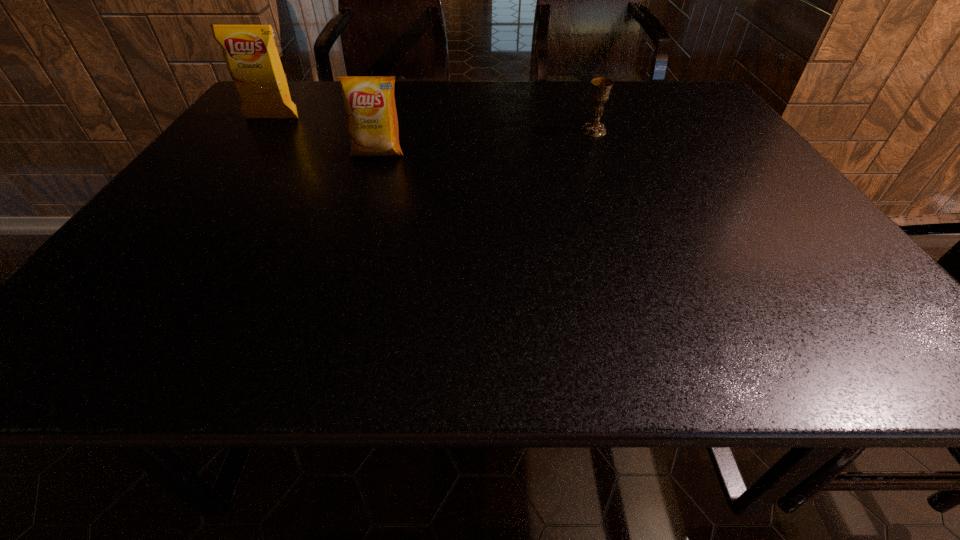
In order to click on free spot between the rightmost object and the farthest object in this screenshot , I will do `click(433, 125)`.

At what (x,y) coordinates should I click in order to perform the action: click on vacant region between the second shortest object and the second nearest object. Please return your answer as a coordinate pair (x, y). Looking at the image, I should click on click(486, 142).

You are a GUI agent. You are given a task and a screenshot of the screen. Output one action in this format:
    pyautogui.click(x=<x>, y=<y>)
    Task: Click on the empty space between the rightmost object and the tallest object
    
    Given the screenshot: What is the action you would take?
    pyautogui.click(x=433, y=125)

Find the location of a particular element. This screenshot has height=540, width=960. free space between the shorter crisp (potato chip) and the leftmost object is located at coordinates (324, 136).

What are the coordinates of `vacant region between the nearest object and the farthest object` in the screenshot? It's located at (324, 136).

Locate an element on the screen. The image size is (960, 540). empty space between the tallest object and the shortest object is located at coordinates (433, 125).

I want to click on free point between the right crisp (potato chip) and the taller crisp (potato chip), so click(x=324, y=136).

Identify the location of the second closest object relative to the nearer crisp (potato chip). The image size is (960, 540). (601, 87).

Find the location of `object that stands as the closest to the farthest object`. object that stands as the closest to the farthest object is located at coordinates (369, 102).

Locate an element on the screen. vacant space that satisfies the following two spatial constraints: 1. on the front of the taller crisp (potato chip) with the logo; 2. on the right side of the chalice is located at coordinates (263, 131).